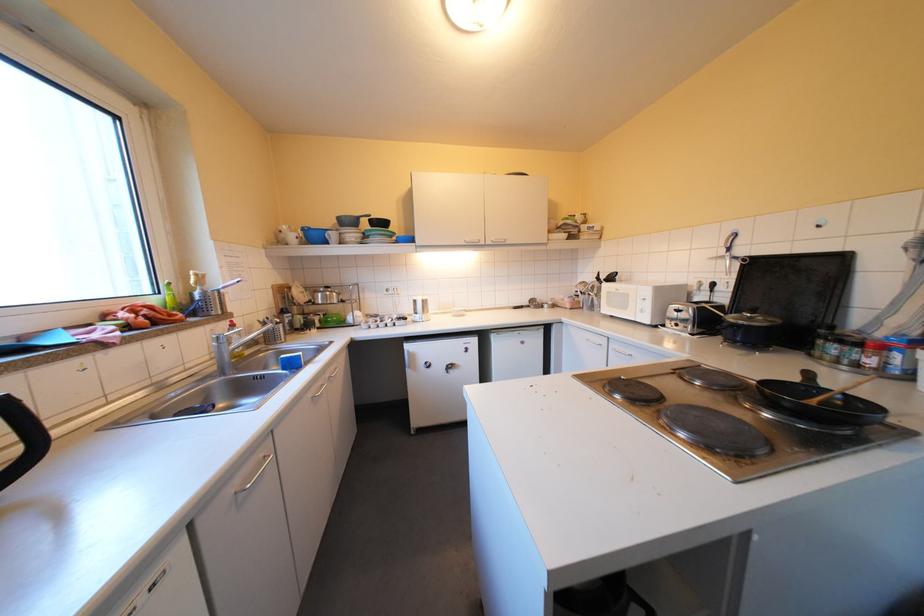
What do you see at coordinates (808, 377) in the screenshot?
I see `the frying pan handle` at bounding box center [808, 377].